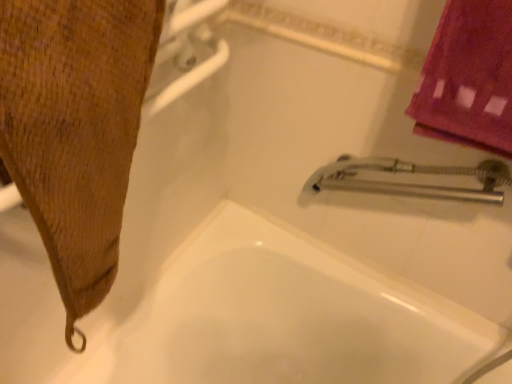
Question: Is white glossy bathtub at center not near brown textured towel at left?

Choices:
 (A) no
 (B) yes

Answer: (A)

Question: Does white glossy bathtub at center come behind brown textured towel at left?

Choices:
 (A) no
 (B) yes

Answer: (B)

Question: Is white glossy bathtub at center in front of brown textured towel at left?

Choices:
 (A) yes
 (B) no

Answer: (B)

Question: Is white glossy bathtub at center oriented towards brown textured towel at left?

Choices:
 (A) yes
 (B) no

Answer: (B)

Question: Can you confirm if white glossy bathtub at center is wider than brown textured towel at left?

Choices:
 (A) no
 (B) yes

Answer: (B)

Question: Is white glossy bathtub at center bigger than brown textured towel at left?

Choices:
 (A) no
 (B) yes

Answer: (B)

Question: Can you confirm if brown textured towel at left is bigger than white glossy bathtub at center?

Choices:
 (A) no
 (B) yes

Answer: (A)

Question: Considering the relative sizes of brown textured towel at left and white glossy bathtub at center in the image provided, is brown textured towel at left smaller than white glossy bathtub at center?

Choices:
 (A) no
 (B) yes

Answer: (B)

Question: Is brown textured towel at left directly adjacent to white glossy bathtub at center?

Choices:
 (A) no
 (B) yes

Answer: (A)

Question: Is brown textured towel at left not close to white glossy bathtub at center?

Choices:
 (A) no
 (B) yes

Answer: (A)

Question: Is brown textured towel at left closer to the viewer compared to white glossy bathtub at center?

Choices:
 (A) yes
 (B) no

Answer: (A)

Question: Is brown textured towel at left facing away from white glossy bathtub at center?

Choices:
 (A) yes
 (B) no

Answer: (B)

Question: Considering the positions of point (65, 44) and point (349, 336), is point (65, 44) closer or farther from the camera than point (349, 336)?

Choices:
 (A) farther
 (B) closer

Answer: (B)